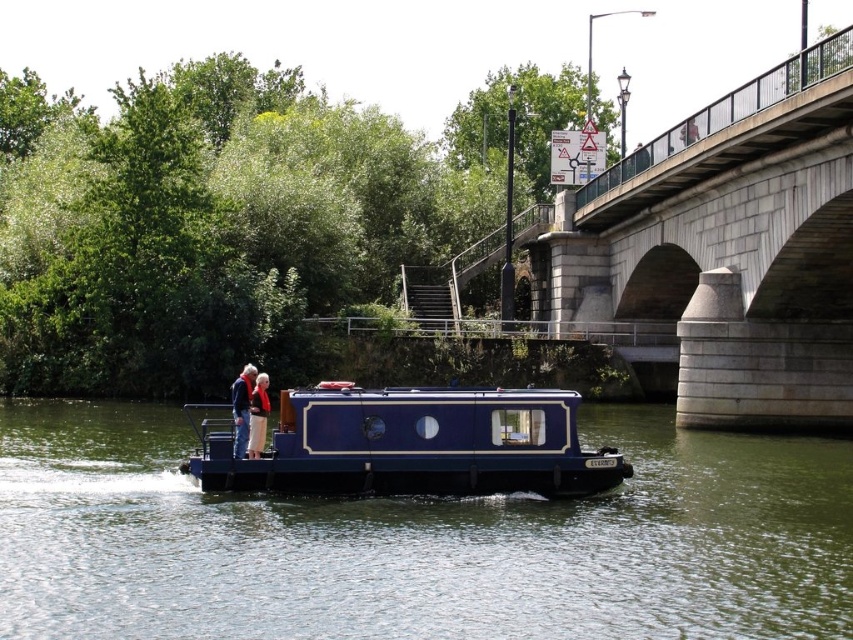
Looking at this image, you are on the deck of the narrowboat and want to hand a map to the person wearing the light beige pants at center. Which direction should you walk to reach them from the blue fabric jacket at center?

The blue fabric jacket at center is to the left of light beige pants at center, so you should walk to the right to reach the light beige pants at center from the blue fabric jacket at center.

You are standing at point (419, 541) and want to board the blue glossy houseboat at center. Is there a clear path to the boat from your current position?

Yes, the blue glossy houseboat at center is located at point (419, 541), so you are already at the boat.

You are on a boat and need to hand a life preserver to someone. The blue fabric jacket at center and the light beige pants at center are both on the same person. Which part of their clothing should you aim for to ensure the preserver reaches them safely?

The blue fabric jacket at center is closer to you than the light beige pants at center, so aim for the blue fabric jacket at center to ensure the life preserver reaches them safely.